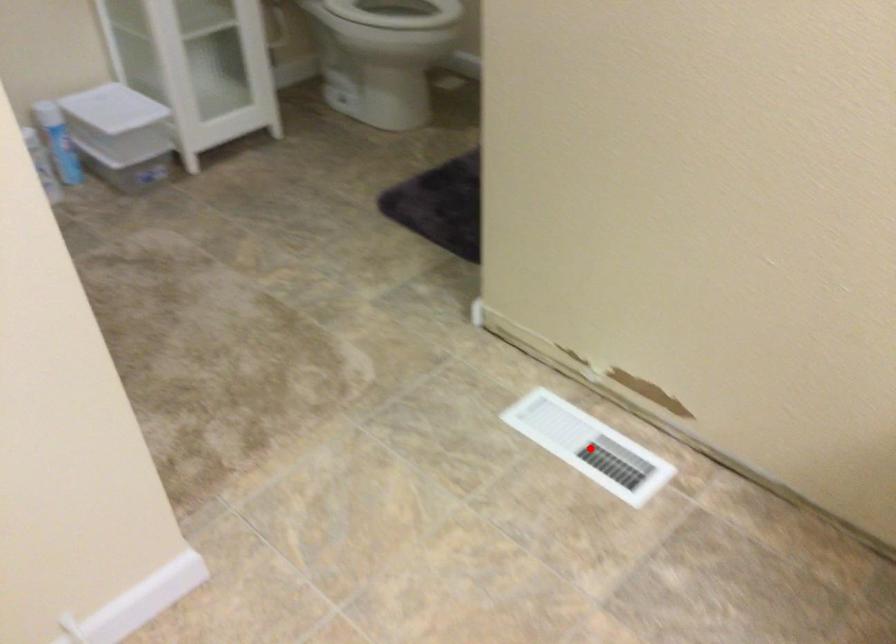
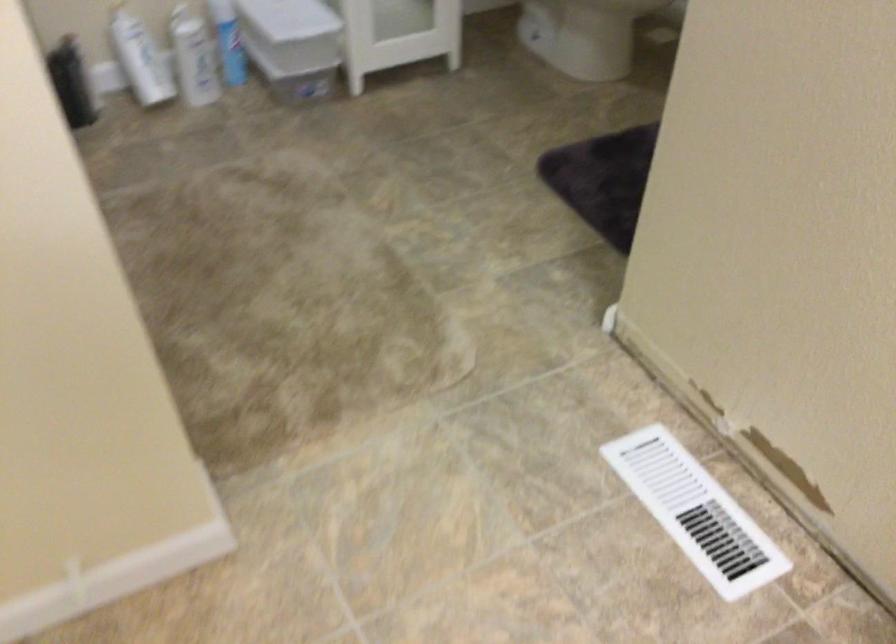
In the second image, find the point that corresponds to the highlighted location in the first image.

(695, 512)